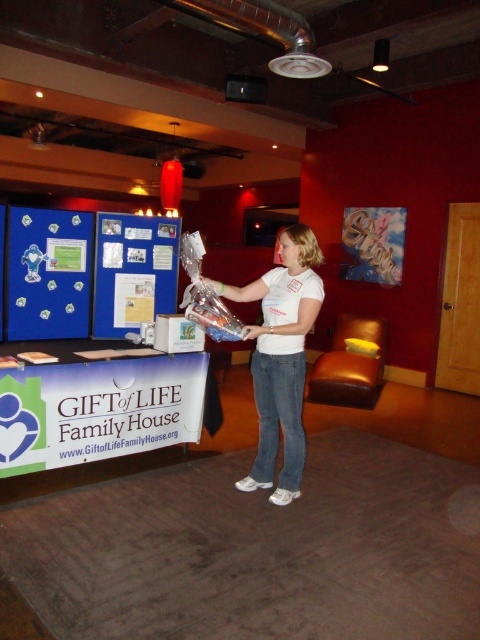
Question: Is white matte shirt at center smaller than blue fabric bulletin board at center?

Choices:
 (A) no
 (B) yes

Answer: (A)

Question: Among these points, which one is nearest to the camera?

Choices:
 (A) (96, 236)
 (B) (283, 237)

Answer: (B)

Question: Which point is closer to the camera?

Choices:
 (A) white matte shirt at center
 (B) blue fabric bulletin board at center

Answer: (A)

Question: Does white matte shirt at center have a smaller size compared to blue fabric bulletin board at center?

Choices:
 (A) no
 (B) yes

Answer: (A)

Question: From the image, what is the correct spatial relationship of white matte shirt at center in relation to blue fabric bulletin board at center?

Choices:
 (A) left
 (B) right

Answer: (B)

Question: Which point is farther from the camera taking this photo?

Choices:
 (A) (163, 300)
 (B) (288, 403)

Answer: (A)